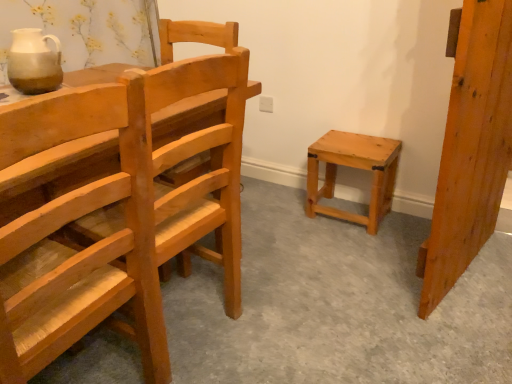
Question: Based on their sizes in the image, would you say matte ceramic jug at upper left is bigger or smaller than natural wood door at right?

Choices:
 (A) small
 (B) big

Answer: (A)

Question: Is matte ceramic jug at upper left wider or thinner than natural wood door at right?

Choices:
 (A) wide
 (B) thin

Answer: (B)

Question: Which object is the farthest from the natural wood door at right?

Choices:
 (A) matte ceramic jug at upper left
 (B) natural wood stool at center-right
 (C) natural wood chair at left

Answer: (A)

Question: Estimate the real-world distances between objects in this image. Which object is farther from the natural wood stool at center-right?

Choices:
 (A) natural wood door at right
 (B) natural wood chair at left
 (C) matte ceramic jug at upper left

Answer: (C)